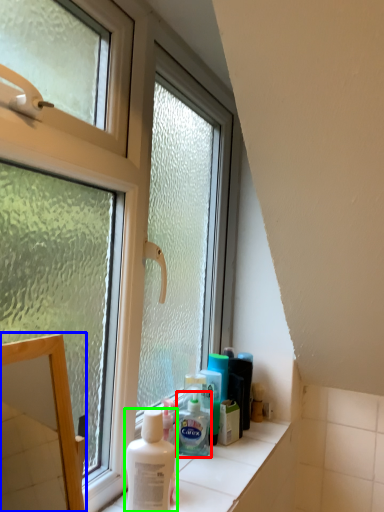
Question: Which object is positioned farthest from shaving cream (highlighted by a red box)? Select from mirror (highlighted by a blue box) and shaving cream (highlighted by a green box).

Choices:
 (A) mirror
 (B) shaving cream

Answer: (A)